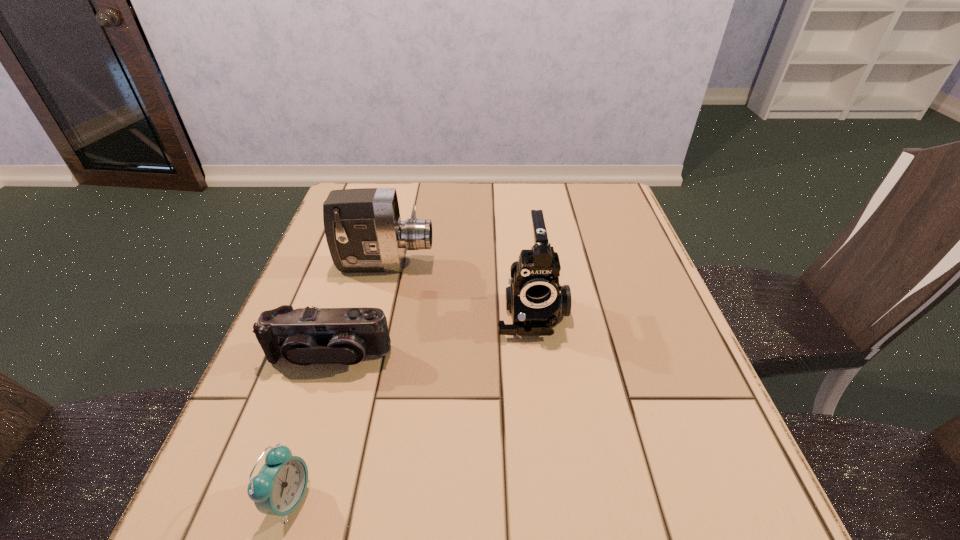
Identify the location of unoccupied area between the nearest object and the rightmost object. (410, 404).

Find the location of a particular element. This screenshot has height=540, width=960. vacant point located between the shortest camcorder and the nearest object is located at coordinates point(309,427).

The image size is (960, 540). I want to click on free space between the shortest camcorder and the alarm clock, so click(309, 427).

Image resolution: width=960 pixels, height=540 pixels. What are the coordinates of `vacant point located between the alarm clock and the farthest camcorder` in the screenshot? It's located at (337, 381).

What are the coordinates of `unoccupied position between the rightmost object and the nearest object` in the screenshot? It's located at (410, 404).

At what (x,y) coordinates should I click in order to perform the action: click on vacant area that lies between the shortest camcorder and the rightmost camcorder. Please return your answer as a coordinate pair (x, y). This screenshot has height=540, width=960. Looking at the image, I should click on (430, 333).

Identify which object is the third closest to the alarm clock. Please provide its 2D coordinates. Your answer should be formatted as a tuple, i.e. [(x, y)], where the tuple contains the x and y coordinates of a point satisfying the conditions above.

[(364, 232)]

Locate an element on the screen. This screenshot has width=960, height=540. object that is the third nearest to the rightmost camcorder is located at coordinates (278, 489).

Find the location of a particular element. This screenshot has height=540, width=960. camcorder that is the third closest to the nearest object is located at coordinates (364, 232).

Where is `camcorder that is the closest to the farthest camcorder`? camcorder that is the closest to the farthest camcorder is located at coordinates (535, 298).